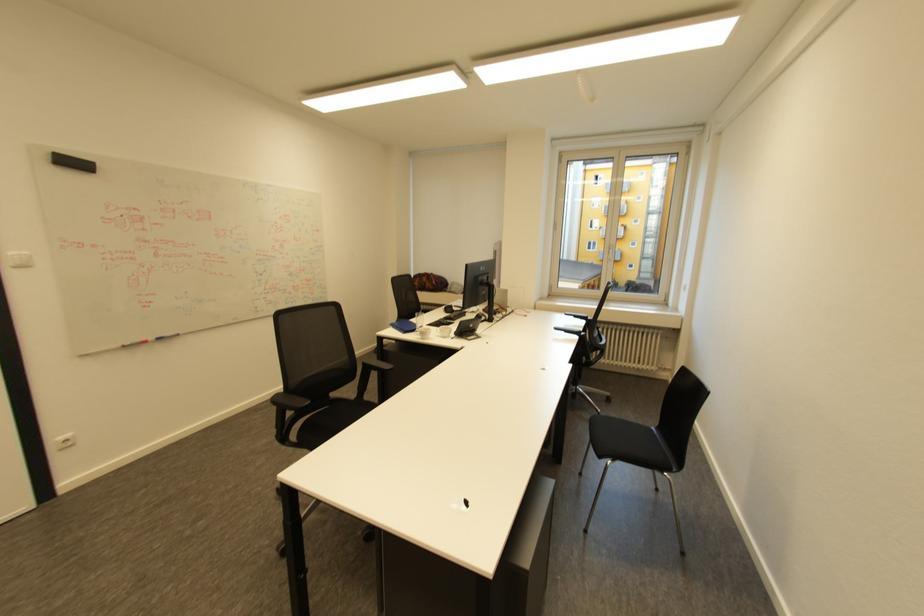
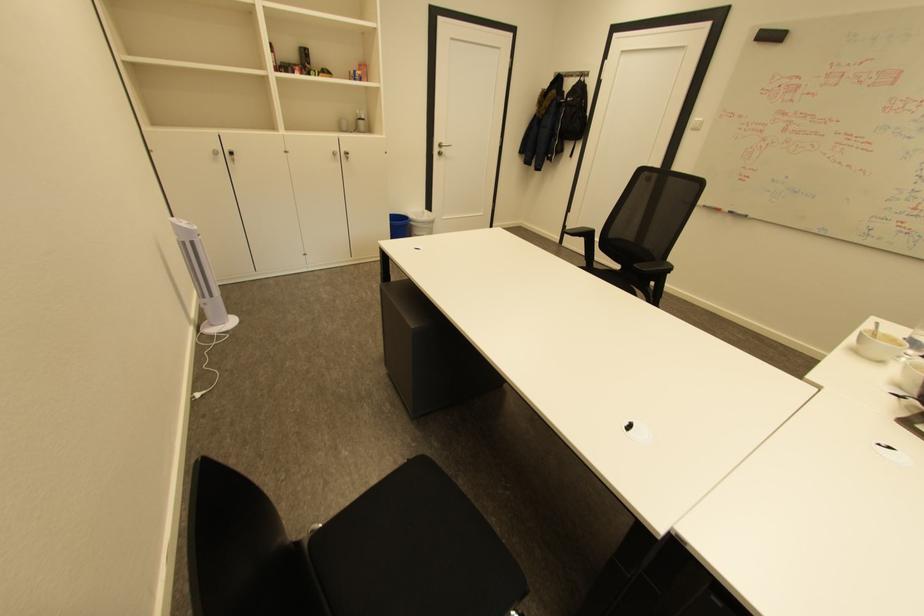
Question: I am providing you with two images of the same scene from different viewpoints. After the viewpoint changes to image2, which objects are now occluded?

Choices:
 (A) blue trash can
 (B) red whiteboard marker
 (C) white tower fan
 (D) none of these

Answer: (D)